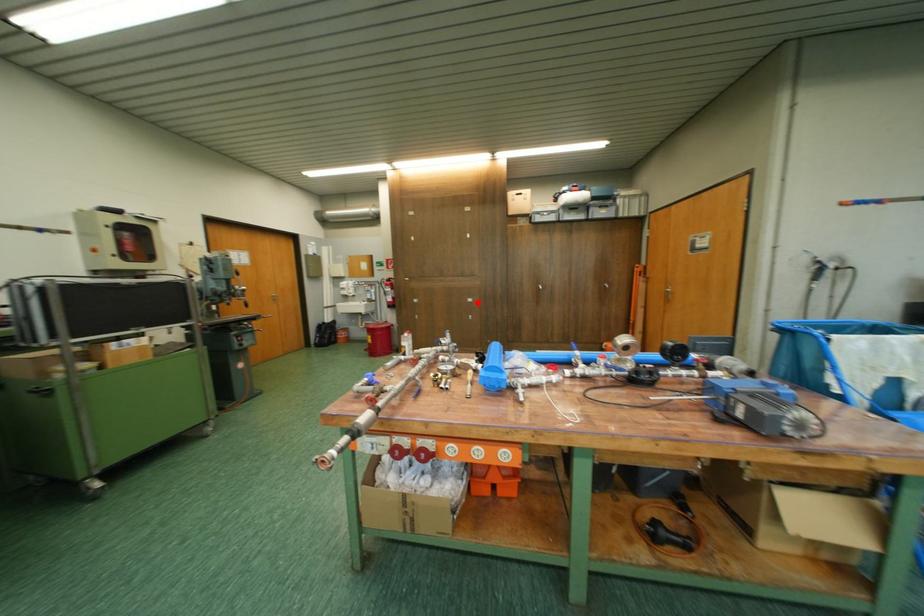
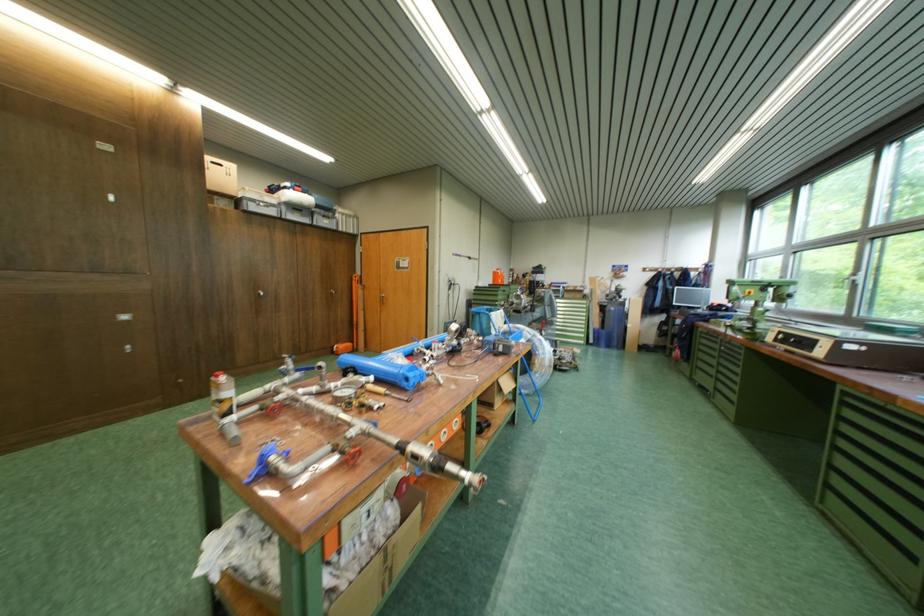
Find the pixel in the second image that matches the highlighted location in the first image.

(127, 321)